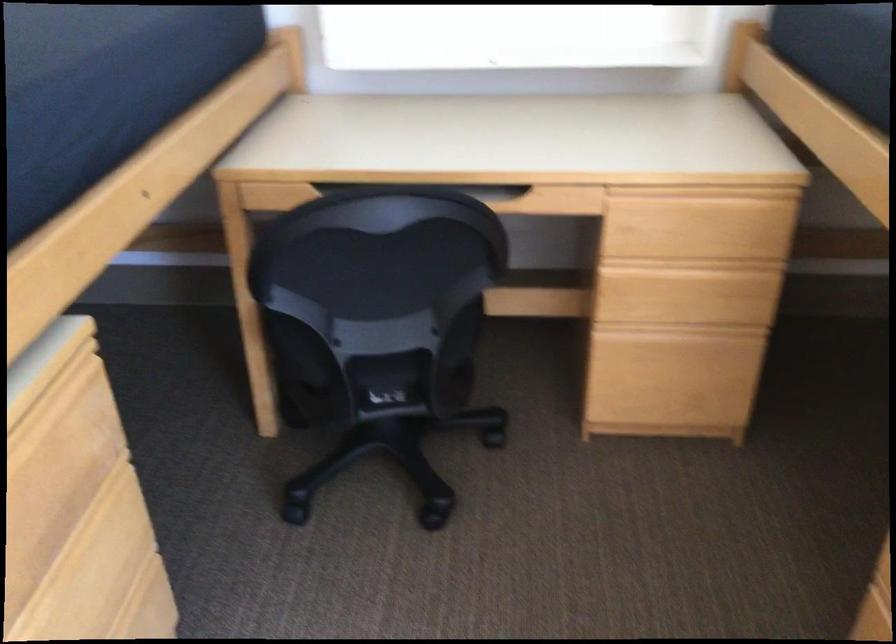
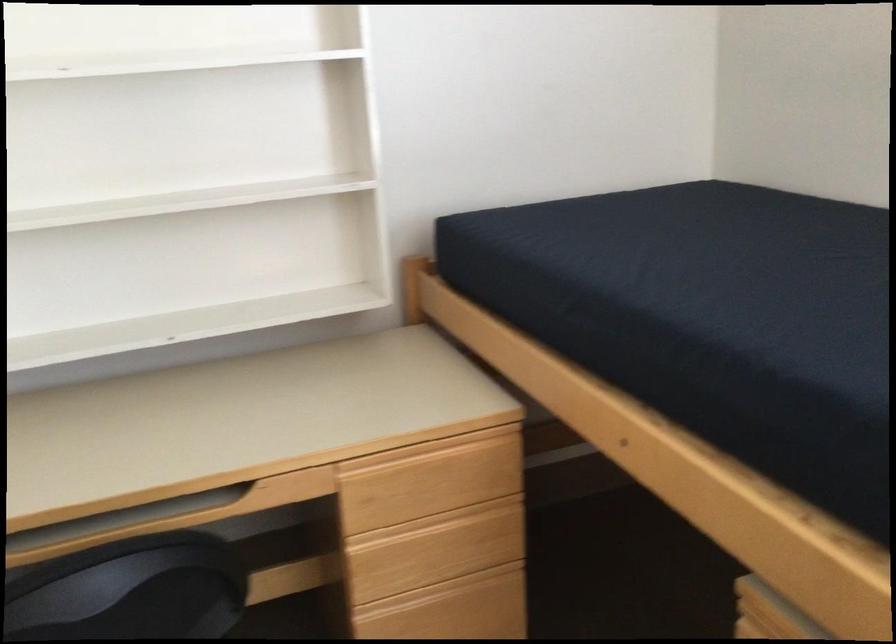
Where in the second image is the point corresponding to pixel 675 335 from the first image?

(442, 592)